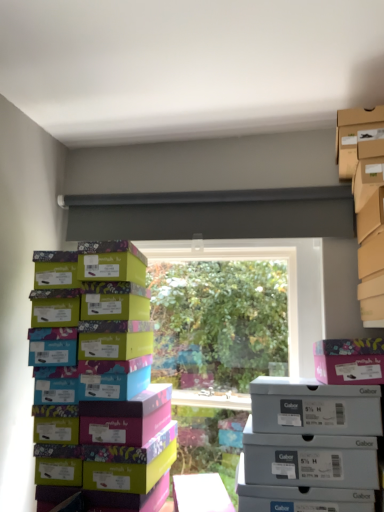
Identify the location of multicolored cardboard shoebox at left. (103, 410).

Describe the element at coordinates (353, 135) in the screenshot. I see `cardboard shoebox at upper right, the second storage box ordered from the bottom` at that location.

What do you see at coordinates (349, 361) in the screenshot?
I see `pink cardboard box at upper right` at bounding box center [349, 361].

The image size is (384, 512). I want to click on gray matte shoebox at lower right, positioned as the 1th storage box in bottom-to-top order, so click(x=310, y=447).

From the picture: Between cardboard shoebox at upper right, the second storage box ordered from the bottom, and multicolored cardboard shoebox at left, which one appears on the left side from the viewer's perspective?

multicolored cardboard shoebox at left is more to the left.

The width and height of the screenshot is (384, 512). What are the coordinates of `box located underneath the cardboard shoebox at upper right, the second storage box ordered from the bottom (from a real-world perspective)` in the screenshot? It's located at (103, 410).

Is cardboard shoebox at upper right, the second storage box ordered from the bottom, further to camera compared to multicolored cardboard shoebox at left?

That is True.

How much distance is there between cardboard shoebox at upper right, the second storage box ordered from the bottom, and gray matte shoebox at lower right, positioned as the 1th storage box in bottom-to-top order?

cardboard shoebox at upper right, the second storage box ordered from the bottom, is 28.88 inches from gray matte shoebox at lower right, positioned as the 1th storage box in bottom-to-top order.

From a real-world perspective, does cardboard shoebox at upper right, the second storage box ordered from the bottom, sit lower than gray matte shoebox at lower right, positioned as the 1th storage box in bottom-to-top order?

No, from a real-world perspective, cardboard shoebox at upper right, the second storage box ordered from the bottom, is not under gray matte shoebox at lower right, positioned as the 1th storage box in bottom-to-top order.

Is gray matte shoebox at lower right, positioned as the 1th storage box in bottom-to-top order, inside cardboard shoebox at upper right, the second storage box ordered from the bottom?

No, gray matte shoebox at lower right, positioned as the 1th storage box in bottom-to-top order, is located outside of cardboard shoebox at upper right, the second storage box ordered from the bottom.

From the image's perspective, does cardboard shoebox at upper right, the second storage box ordered from the bottom, appear higher than gray matte shoebox at lower right, positioned as the 1th storage box in bottom-to-top order?

Yes, from the image's perspective, cardboard shoebox at upper right, the second storage box ordered from the bottom, is over gray matte shoebox at lower right, positioned as the 1th storage box in bottom-to-top order.

Which is more to the left, gray matte shoebox at lower right, positioned as the 1th storage box in bottom-to-top order, or pink cardboard box at upper right?

gray matte shoebox at lower right, positioned as the 1th storage box in bottom-to-top order.

Which of these two, gray matte shoebox at lower right, positioned as the 1th storage box in bottom-to-top order, or pink cardboard box at upper right, is wider?

pink cardboard box at upper right.

Does point (241, 481) appear closer or farther from the camera than point (370, 339)?

Point (241, 481) appears to be closer to the viewer than point (370, 339).

Does gray matte shoebox at lower right, the second storage box positioned from the top, lie in front of pink cardboard box at upper right?

Yes, it is.

Considering their positions, is pink cardboard box at upper right located in front of or behind multicolored cardboard shoebox at left?

In the image, pink cardboard box at upper right appears behind multicolored cardboard shoebox at left.

Based on their sizes in the image, would you say pink cardboard box at upper right is bigger or smaller than multicolored cardboard shoebox at left?

Considering their sizes, pink cardboard box at upper right takes up less space than multicolored cardboard shoebox at left.

From a real-world perspective, is pink cardboard box at upper right above or below multicolored cardboard shoebox at left?

pink cardboard box at upper right is situated higher than multicolored cardboard shoebox at left in the real world.

In the scene shown: Is pink cardboard box at upper right facing towards multicolored cardboard shoebox at left?

No, pink cardboard box at upper right does not turn towards multicolored cardboard shoebox at left.

Are multicolored cardboard shoebox at left and pink cardboard box at upper right making contact?

multicolored cardboard shoebox at left and pink cardboard box at upper right are not in contact.

Is point (80, 336) positioned before point (374, 347)?

No, it is not.

Is multicolored cardboard shoebox at left facing towards pink cardboard box at upper right?

No, multicolored cardboard shoebox at left does not turn towards pink cardboard box at upper right.

Does multicolored cardboard shoebox at left have a lesser height compared to pink cardboard box at upper right?

No, multicolored cardboard shoebox at left is not shorter than pink cardboard box at upper right.

Looking at this image, from a real-world perspective, which object stands above the other?

In real-world perspective, pink cardboard box at upper right is above.

Does pink cardboard box at upper right have a lesser height compared to gray matte shoebox at lower right, the second storage box positioned from the top?

Yes, pink cardboard box at upper right is shorter than gray matte shoebox at lower right, the second storage box positioned from the top.

Does pink cardboard box at upper right come in front of gray matte shoebox at lower right, positioned as the 1th storage box in bottom-to-top order?

No, pink cardboard box at upper right is further to the viewer.

Does multicolored cardboard shoebox at left have a lesser width compared to cardboard shoebox at upper right, placed as the 1th storage box when sorted from top to bottom?

In fact, multicolored cardboard shoebox at left might be wider than cardboard shoebox at upper right, placed as the 1th storage box when sorted from top to bottom.

Find the location of `storage box that appears behind the multicolored cardboard shoebox at left`. storage box that appears behind the multicolored cardboard shoebox at left is located at coordinates (353, 135).

Is multicolored cardboard shoebox at left aimed at cardboard shoebox at upper right, the second storage box ordered from the bottom?

No, multicolored cardboard shoebox at left is not facing towards cardboard shoebox at upper right, the second storage box ordered from the bottom.

From a real-world perspective, is multicolored cardboard shoebox at left positioned over cardboard shoebox at upper right, the second storage box ordered from the bottom, based on gravity?

Actually, multicolored cardboard shoebox at left is physically below cardboard shoebox at upper right, the second storage box ordered from the bottom, in the real world.

Find the location of `box on the left of cardboard shoebox at upper right, the second storage box ordered from the bottom`. box on the left of cardboard shoebox at upper right, the second storage box ordered from the bottom is located at coordinates (103, 410).

Find the location of `storage box behind the gray matte shoebox at lower right, positioned as the 1th storage box in bottom-to-top order`. storage box behind the gray matte shoebox at lower right, positioned as the 1th storage box in bottom-to-top order is located at coordinates (353, 135).

Considering their positions, is pink cardboard box at upper right positioned closer to cardboard shoebox at upper right, the second storage box ordered from the bottom, than gray matte shoebox at lower right, the second storage box positioned from the top?

The object closer to cardboard shoebox at upper right, the second storage box ordered from the bottom, is pink cardboard box at upper right.

Which object lies further to the anchor point pink cardboard box at upper right, multicolored cardboard shoebox at left or cardboard shoebox at upper right, the second storage box ordered from the bottom?

Based on the image, multicolored cardboard shoebox at left appears to be further to pink cardboard box at upper right.

Looking at this image, estimate the real-world distances between objects in this image. Which object is closer to cardboard shoebox at upper right, placed as the 1th storage box when sorted from top to bottom, multicolored cardboard shoebox at left or pink cardboard box at upper right?

pink cardboard box at upper right is closer to cardboard shoebox at upper right, placed as the 1th storage box when sorted from top to bottom.

Estimate the real-world distances between objects in this image. Which object is closer to gray matte shoebox at lower right, positioned as the 1th storage box in bottom-to-top order, multicolored cardboard shoebox at left or pink cardboard box at upper right?

pink cardboard box at upper right is closer to gray matte shoebox at lower right, positioned as the 1th storage box in bottom-to-top order.

Which object lies nearer to the anchor point cardboard shoebox at upper right, placed as the 1th storage box when sorted from top to bottom, gray matte shoebox at lower right, the second storage box positioned from the top, or pink cardboard box at upper right?

The object closer to cardboard shoebox at upper right, placed as the 1th storage box when sorted from top to bottom, is pink cardboard box at upper right.

Based on their spatial positions, is cardboard shoebox at upper right, placed as the 1th storage box when sorted from top to bottom, or multicolored cardboard shoebox at left closer to pink cardboard box at upper right?

Based on the image, cardboard shoebox at upper right, placed as the 1th storage box when sorted from top to bottom, appears to be nearer to pink cardboard box at upper right.

Based on their spatial positions, is pink cardboard box at upper right or cardboard shoebox at upper right, the second storage box ordered from the bottom, closer to gray matte shoebox at lower right, the second storage box positioned from the top?

The object closer to gray matte shoebox at lower right, the second storage box positioned from the top, is pink cardboard box at upper right.

Based on their spatial positions, is pink cardboard box at upper right or multicolored cardboard shoebox at left further from cardboard shoebox at upper right, placed as the 1th storage box when sorted from top to bottom?

multicolored cardboard shoebox at left is further to cardboard shoebox at upper right, placed as the 1th storage box when sorted from top to bottom.

Find the location of a particular element. cardboard box between cardboard shoebox at upper right, the second storage box ordered from the bottom, and gray matte shoebox at lower right, positioned as the 1th storage box in bottom-to-top order, in the up-down direction is located at coordinates (349, 361).

The width and height of the screenshot is (384, 512). Identify the location of storage box situated between multicolored cardboard shoebox at left and pink cardboard box at upper right from left to right. (310, 447).

Where is `cardboard box between multicolored cardboard shoebox at left and cardboard shoebox at upper right, placed as the 1th storage box when sorted from top to bottom`? cardboard box between multicolored cardboard shoebox at left and cardboard shoebox at upper right, placed as the 1th storage box when sorted from top to bottom is located at coordinates (349, 361).

The height and width of the screenshot is (512, 384). I want to click on box between cardboard shoebox at upper right, placed as the 1th storage box when sorted from top to bottom, and gray matte shoebox at lower right, positioned as the 1th storage box in bottom-to-top order, vertically, so click(103, 410).